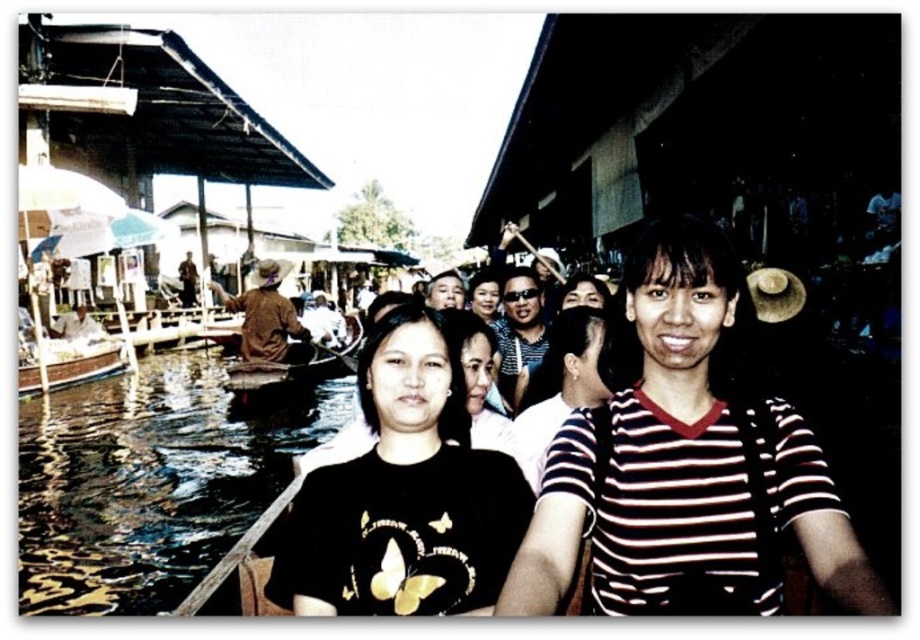
Does brown clothed man at left appear under brown wooden paddle at lower left?

Actually, brown clothed man at left is above brown wooden paddle at lower left.

Is brown clothed man at left thinner than brown wooden paddle at lower left?

No.

Is point (240, 356) positioned before point (87, 312)?

That is True.

Identify the location of brown clothed man at left. This screenshot has height=640, width=920. (265, 316).

Does point (317, 326) come in front of point (476, 298)?

No, (317, 326) is behind (476, 298).

Does point (312, 314) come farther from viewer compared to point (497, 314)?

That is True.

Image resolution: width=920 pixels, height=640 pixels. Find the location of `white cotton shirt at center`. white cotton shirt at center is located at coordinates (323, 323).

Which is more to the left, matte black sunglasses at center or white cotton shirt at center?

white cotton shirt at center

Can you confirm if matte black sunglasses at center is wider than white cotton shirt at center?

No.

Which is behind, point (530, 332) or point (314, 324)?

The point (314, 324) is more distant.

The height and width of the screenshot is (640, 920). Identify the location of matte black sunglasses at center. (519, 333).